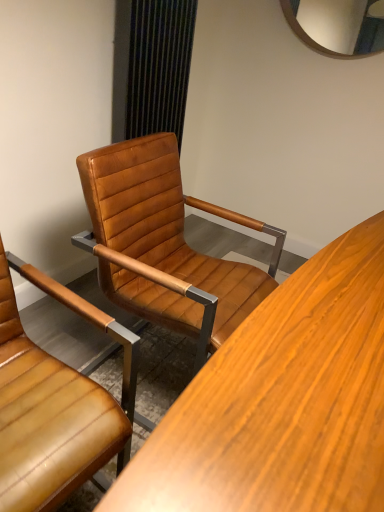
Question: From the image's perspective, is black textured curtain at upper center above or below leather at center, which ranks as the 1th chair in right-to-left order?

Choices:
 (A) above
 (B) below

Answer: (A)

Question: Looking at the image, does black textured curtain at upper center seem bigger or smaller compared to leather at center, which ranks as the 1th chair in right-to-left order?

Choices:
 (A) big
 (B) small

Answer: (B)

Question: Estimate the real-world distances between objects in this image. Which object is farther from the leather at center, which ranks as the 1th chair in right-to-left order?

Choices:
 (A) black textured curtain at upper center
 (B) leather at center, the first chair from the left

Answer: (A)

Question: Based on their relative distances, which object is farther from the black textured curtain at upper center?

Choices:
 (A) leather at center, the first chair from the left
 (B) leather at center, which ranks as the second chair in left-to-right order

Answer: (A)